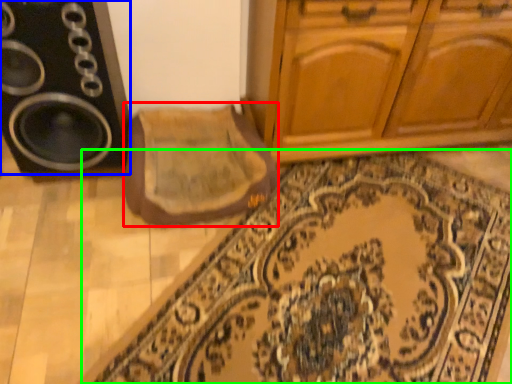
Question: Estimate the real-world distances between objects in this image. Which object is closer to mat (highlighted by a red box), speaker (highlighted by a blue box) or doormat (highlighted by a green box)?

Choices:
 (A) speaker
 (B) doormat

Answer: (A)